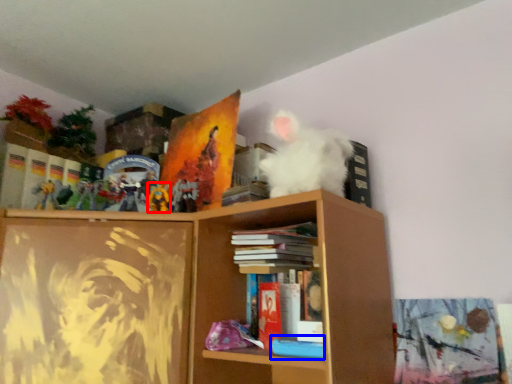
Question: Which object appears closest to the camera in this image, toy (highlighted by a red box) or book (highlighted by a blue box)?

Choices:
 (A) toy
 (B) book

Answer: (B)